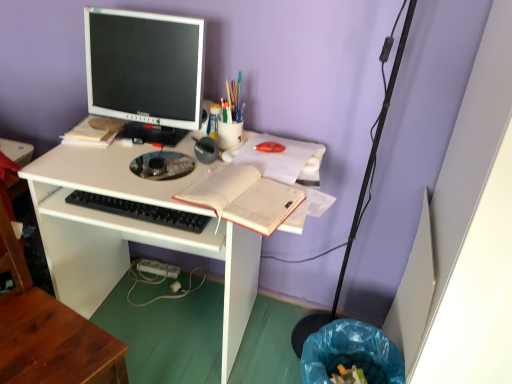
Question: Does wooden at left come behind translucent plastic cup at upper center, which is the third stationery in front-to-back order?

Choices:
 (A) yes
 (B) no

Answer: (B)

Question: Considering the relative sizes of wooden at left and translucent plastic cup at upper center, which is the third stationery in front-to-back order, in the image provided, is wooden at left thinner than translucent plastic cup at upper center, which is the third stationery in front-to-back order,?

Choices:
 (A) yes
 (B) no

Answer: (B)

Question: Is wooden at left turned away from translucent plastic cup at upper center, which is the third stationery in front-to-back order?

Choices:
 (A) yes
 (B) no

Answer: (B)

Question: Could you tell me if wooden at left is facing translucent plastic cup at upper center, which is the third stationery in front-to-back order?

Choices:
 (A) no
 (B) yes

Answer: (A)

Question: Is wooden at left to the left of translucent plastic cup at upper center, marked as the first stationery in a back-to-front arrangement, from the viewer's perspective?

Choices:
 (A) yes
 (B) no

Answer: (A)

Question: Is matte plastic cup at upper center, which appears as the second stationery when viewed from the front, taller or shorter than wooden at left?

Choices:
 (A) short
 (B) tall

Answer: (A)

Question: Considering the positions of point (231, 117) and point (55, 304), is point (231, 117) closer or farther from the camera than point (55, 304)?

Choices:
 (A) closer
 (B) farther

Answer: (B)

Question: In terms of size, does matte plastic cup at upper center, acting as the 2th stationery starting from the back, appear bigger or smaller than wooden at left?

Choices:
 (A) big
 (B) small

Answer: (B)

Question: Is matte plastic cup at upper center, which appears as the second stationery when viewed from the front, wider or thinner than wooden at left?

Choices:
 (A) thin
 (B) wide

Answer: (A)

Question: From the image's perspective, relative to metallic gray pen at center, the 1th stationery from the front, is white paper notebook at center above or below?

Choices:
 (A) above
 (B) below

Answer: (B)

Question: From a real-world perspective, relative to metallic gray pen at center, marked as the third stationery in a back-to-front arrangement, is white paper notebook at center vertically above or below?

Choices:
 (A) below
 (B) above

Answer: (A)

Question: Which is correct: white paper notebook at center is inside metallic gray pen at center, marked as the third stationery in a back-to-front arrangement, or outside of it?

Choices:
 (A) outside
 (B) inside

Answer: (A)

Question: Is white paper notebook at center in front of or behind metallic gray pen at center, marked as the third stationery in a back-to-front arrangement, in the image?

Choices:
 (A) behind
 (B) front

Answer: (B)

Question: Considering the positions of white paper notebook at center and white plastic power plugs and sockets at lower center in the image, is white paper notebook at center wider or thinner than white plastic power plugs and sockets at lower center?

Choices:
 (A) wide
 (B) thin

Answer: (A)

Question: From the image's perspective, is white paper notebook at center positioned above or below white plastic power plugs and sockets at lower center?

Choices:
 (A) below
 (B) above

Answer: (B)